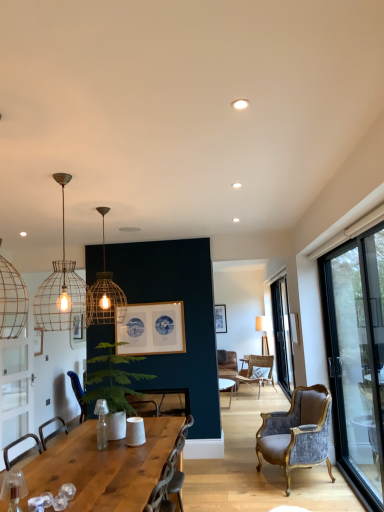
Image resolution: width=384 pixels, height=512 pixels. Identify the location of free location above metal wire pendant light at upper left, marked as the first lamp in a front-to-back arrangement (from a real-world perspective). (62, 175).